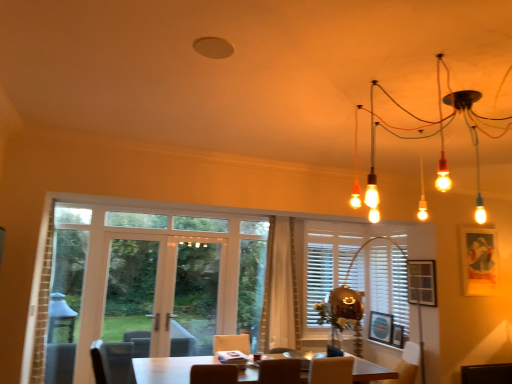
Question: Is wooden screen door at left, positioned as the 1th screen door in left-to-right order, taller than wooden picture frame at right, acting as the second picture frame starting from the right?

Choices:
 (A) yes
 (B) no

Answer: (A)

Question: From the image's perspective, would you say wooden screen door at left, positioned as the 1th screen door in left-to-right order, is shown under wooden picture frame at right, the 3th picture frame in the left-to-right sequence?

Choices:
 (A) yes
 (B) no

Answer: (A)

Question: Is the depth of wooden screen door at left, positioned as the 1th screen door in left-to-right order, greater than that of wooden picture frame at right, the 3th picture frame in the left-to-right sequence?

Choices:
 (A) yes
 (B) no

Answer: (A)

Question: Is wooden screen door at left, which is counted as the 2th screen door, starting from the right, far away from wooden picture frame at right, the 3th picture frame in the left-to-right sequence?

Choices:
 (A) no
 (B) yes

Answer: (B)

Question: Would you say wooden picture frame at right, acting as the second picture frame starting from the right, is part of wooden screen door at left, positioned as the 1th screen door in left-to-right order,'s contents?

Choices:
 (A) no
 (B) yes

Answer: (A)

Question: Does wooden screen door at left, positioned as the 1th screen door in left-to-right order, appear on the left side of wooden picture frame at right, acting as the second picture frame starting from the right?

Choices:
 (A) yes
 (B) no

Answer: (A)

Question: Is white matte blinds at center to the right of matte black picture frame at upper right, which is the 4th picture frame in left-to-right order, from the viewer's perspective?

Choices:
 (A) no
 (B) yes

Answer: (A)

Question: From the image's perspective, is white matte blinds at center over matte black picture frame at upper right, the first picture frame from the right?

Choices:
 (A) no
 (B) yes

Answer: (A)

Question: From a real-world perspective, is white matte blinds at center beneath matte black picture frame at upper right, the first picture frame from the right?

Choices:
 (A) no
 (B) yes

Answer: (B)

Question: From a real-world perspective, is white matte blinds at center located higher than matte black picture frame at upper right, the first picture frame from the right?

Choices:
 (A) yes
 (B) no

Answer: (B)

Question: Is white matte blinds at center positioned in front of matte black picture frame at upper right, the first picture frame from the right?

Choices:
 (A) yes
 (B) no

Answer: (B)

Question: Is white matte blinds at center turned away from matte black picture frame at upper right, which is the 4th picture frame in left-to-right order?

Choices:
 (A) yes
 (B) no

Answer: (B)

Question: From the image's perspective, is white glossy table at center under white sheer curtain at center?

Choices:
 (A) no
 (B) yes

Answer: (B)